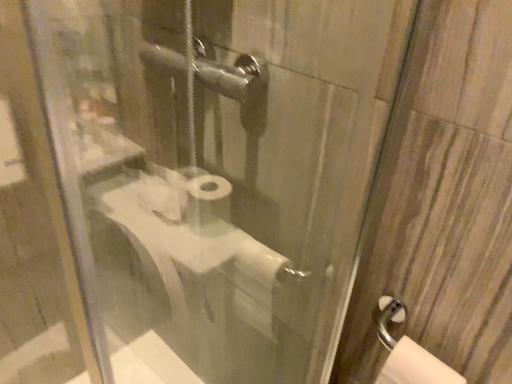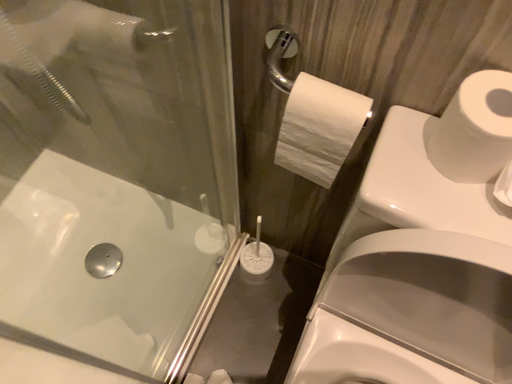
Question: How did the camera likely rotate when shooting the video?

Choices:
 (A) rotated upward
 (B) rotated downward

Answer: (B)